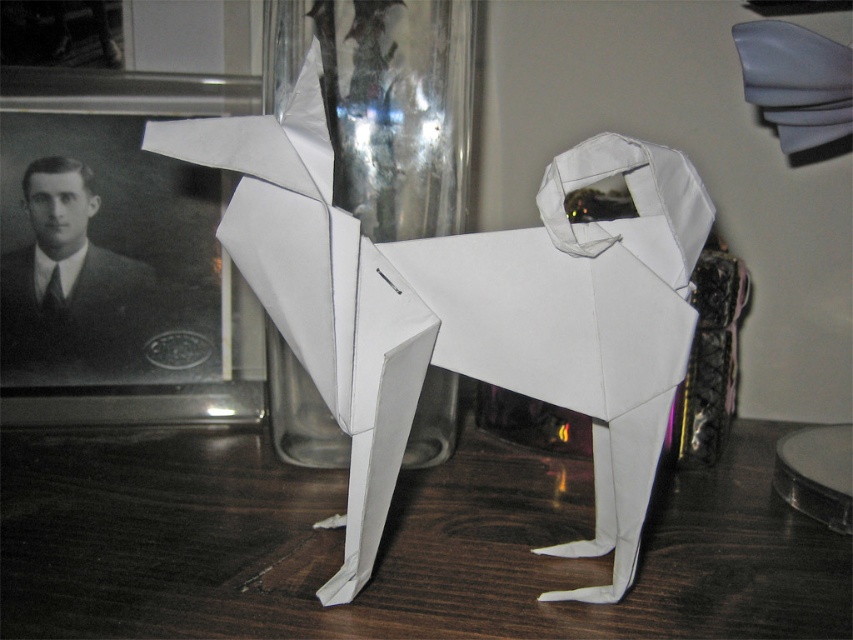
Which is below, wooden table at center or transparent glass at center?

wooden table at center is below.

From the picture: Is wooden table at center below transparent glass at center?

Yes, wooden table at center is below transparent glass at center.

Identify the location of wooden table at center. This screenshot has width=853, height=640. (392, 547).